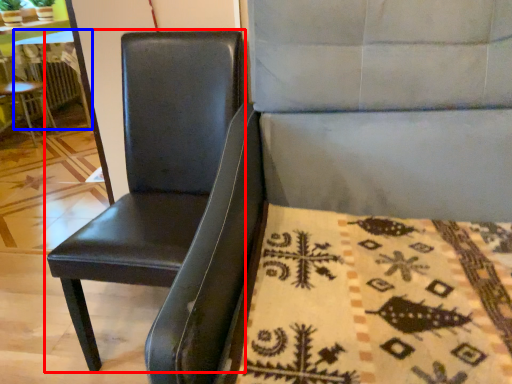
Question: Which object appears closest to the camera in this image, chair (highlighted by a red box) or table (highlighted by a blue box)?

Choices:
 (A) chair
 (B) table

Answer: (A)